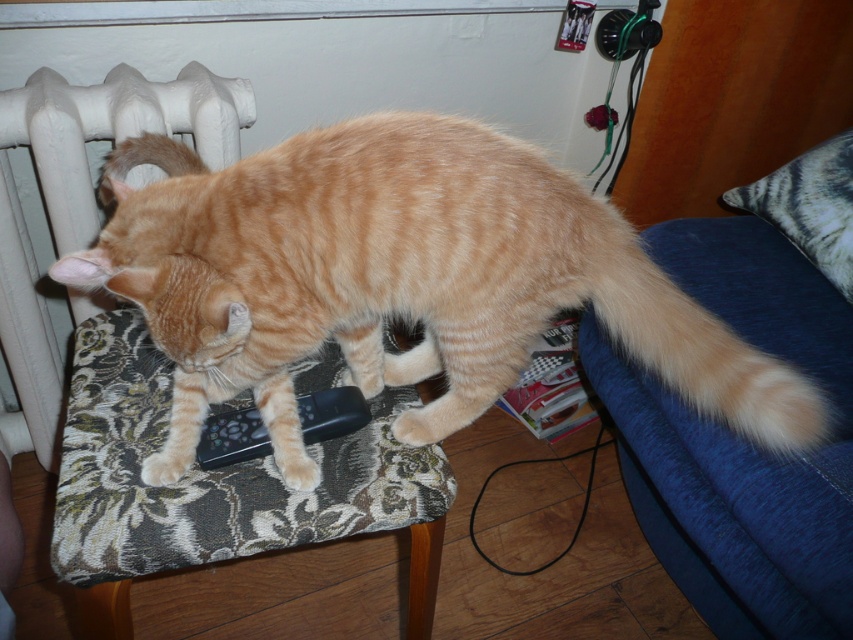
Question: Is floral fabric armchair at center positioned behind black plastic remote at center?

Choices:
 (A) yes
 (B) no

Answer: (A)

Question: Observing the image, what is the correct spatial positioning of black plastic remote at center in reference to orange fur paw at lower left?

Choices:
 (A) right
 (B) left

Answer: (A)

Question: Which object is positioned farthest from the black plastic remote at center?

Choices:
 (A) light brown fur paw at center
 (B) orange fur paw at lower left
 (C) blue fabric armchair at lower right
 (D) white matte radiator at upper left

Answer: (C)

Question: Can you confirm if orange striped fur cat at center is positioned below floral fabric armchair at center?

Choices:
 (A) yes
 (B) no

Answer: (A)

Question: Among these points, which one is farthest from the camera?

Choices:
 (A) (664, 401)
 (B) (142, 465)
 (C) (91, 108)

Answer: (A)

Question: Which object appears closest to the camera in this image?

Choices:
 (A) orange fur paw at lower left
 (B) blue fabric armchair at lower right
 (C) light brown fur paw at center
 (D) black plastic remote at center

Answer: (A)